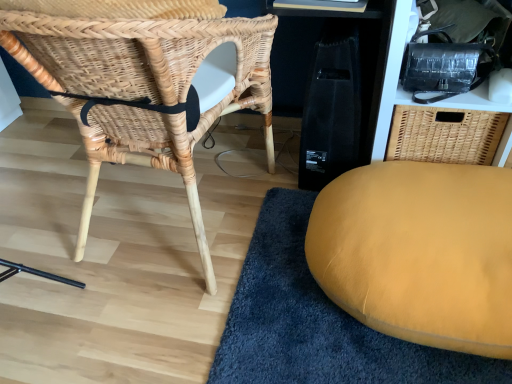
Question: From the image's perspective, is mustard yellow cushion at lower right above or below natural woven chair at left?

Choices:
 (A) above
 (B) below

Answer: (B)

Question: Is mustard yellow cushion at lower right wider or thinner than natural woven chair at left?

Choices:
 (A) thin
 (B) wide

Answer: (A)

Question: Considering the real-world distances, which object is farthest from the black textured bag at upper right?

Choices:
 (A) mustard yellow cushion at lower right
 (B) natural woven chair at left

Answer: (B)

Question: Which object is the farthest from the natural woven chair at left?

Choices:
 (A) black textured bag at upper right
 (B) mustard yellow cushion at lower right

Answer: (A)